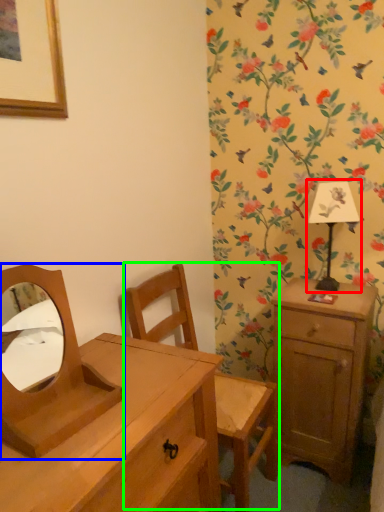
Question: Based on their relative distances, which object is nearer to bedside lamp (highlighted by a red box)? Choose from mirror (highlighted by a blue box) and swivel chair (highlighted by a green box).

Choices:
 (A) mirror
 (B) swivel chair

Answer: (B)